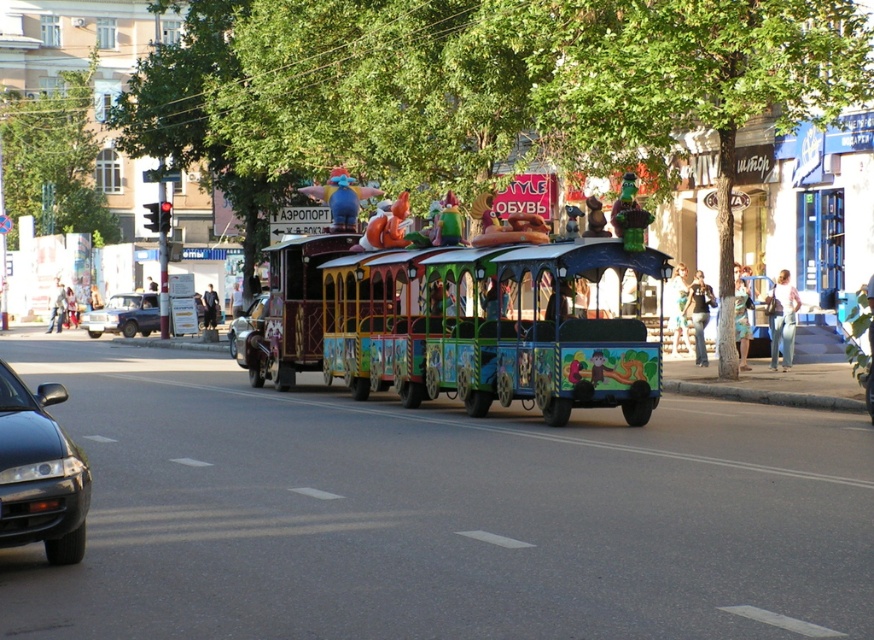
Question: Which of these objects is positioned farthest from the dark blue suit at center?

Choices:
 (A) denim skirt at right
 (B) matte silver suv at left

Answer: (A)

Question: Is shiny silver car at center wider than dark blue suit at center?

Choices:
 (A) yes
 (B) no

Answer: (A)

Question: Is denim jeans at center to the left of dark blue suit at center from the viewer's perspective?

Choices:
 (A) yes
 (B) no

Answer: (B)

Question: Which point is farther from the camera taking this photo?

Choices:
 (A) (671, 336)
 (B) (734, 308)
 (C) (869, 364)
 (D) (207, 289)

Answer: (D)

Question: Can you confirm if jeans at center is bigger than dark blue suit at center?

Choices:
 (A) yes
 (B) no

Answer: (B)

Question: Which object is closer to the camera taking this photo?

Choices:
 (A) shiny silver car at center
 (B) dark blue suit at center
 (C) jeans at center
 (D) denim skirt at right

Answer: (C)